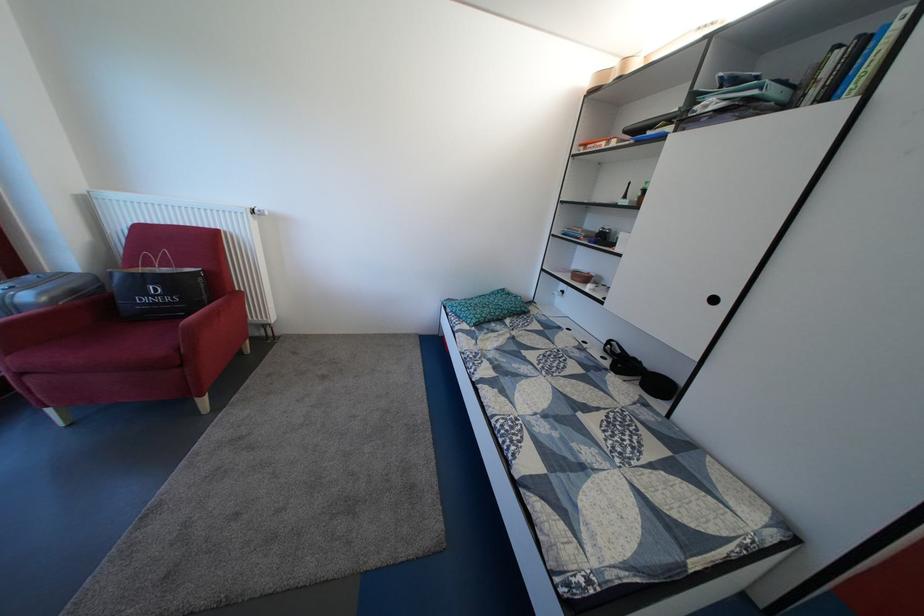
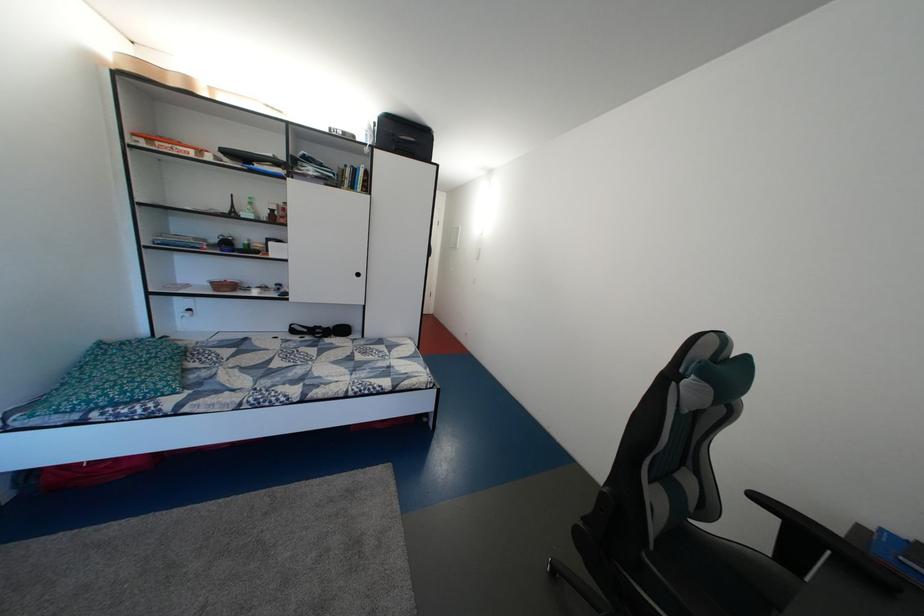
In the second image, find the point that corresponds to (x=619, y=148) in the first image.

(211, 159)